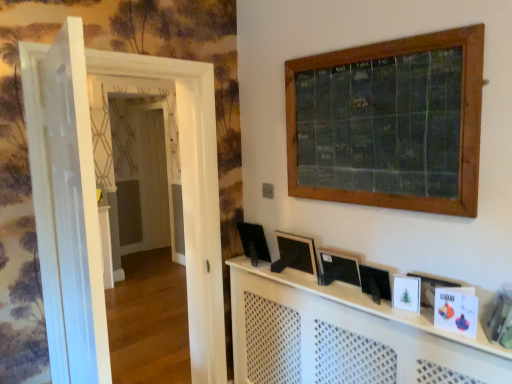
Find the location of a particular element. The image size is (512, 384). free space that is to the left of white matte picture frame at lower right, the 3th picture frame viewed from the back is located at coordinates (373, 302).